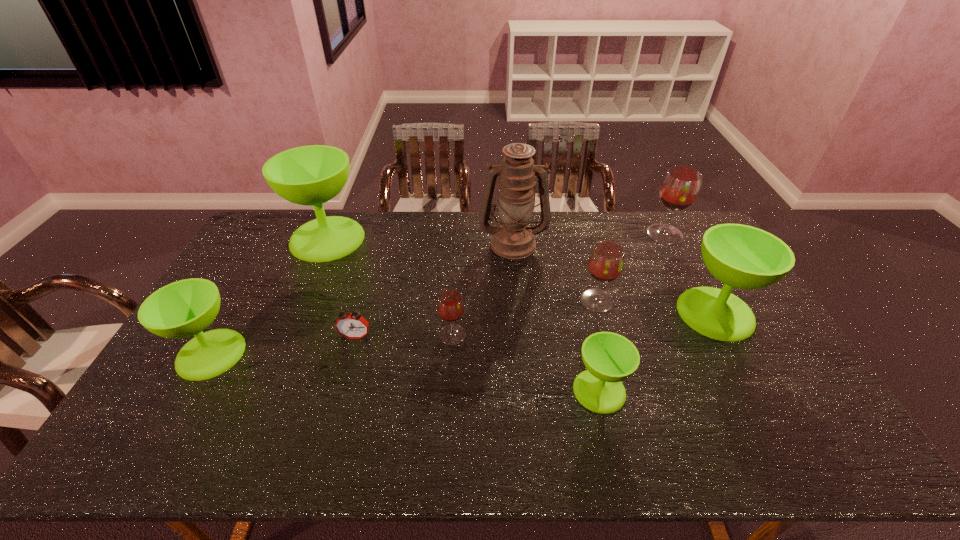
This screenshot has height=540, width=960. Identify the location of the nearest red wineglass. (450, 305).

This screenshot has height=540, width=960. I want to click on the smallest green wineglass, so click(609, 358).

Where is `the seventh object from right to left`? This screenshot has width=960, height=540. the seventh object from right to left is located at coordinates (350, 325).

Where is `the shortest object`? the shortest object is located at coordinates (350, 325).

What are the coordinates of `blank area located 0.330m on the right of the oil lamp` in the screenshot? It's located at (637, 244).

What are the coordinates of `free region located on the front of the second tallest object` in the screenshot? It's located at (294, 318).

Locate an element on the screen. The image size is (960, 540). vacant space located 0.160m on the front of the biggest red wineglass is located at coordinates (685, 274).

In order to click on free region located on the front of the second biggest green wineglass in this screenshot , I will do `click(784, 440)`.

The height and width of the screenshot is (540, 960). In order to click on vacant space situated 0.220m on the front of the second red wineglass from left to right in this screenshot , I will do (x=616, y=372).

Where is `vacant position located 0.240m on the right of the second smallest green wineglass`? vacant position located 0.240m on the right of the second smallest green wineglass is located at coordinates (328, 354).